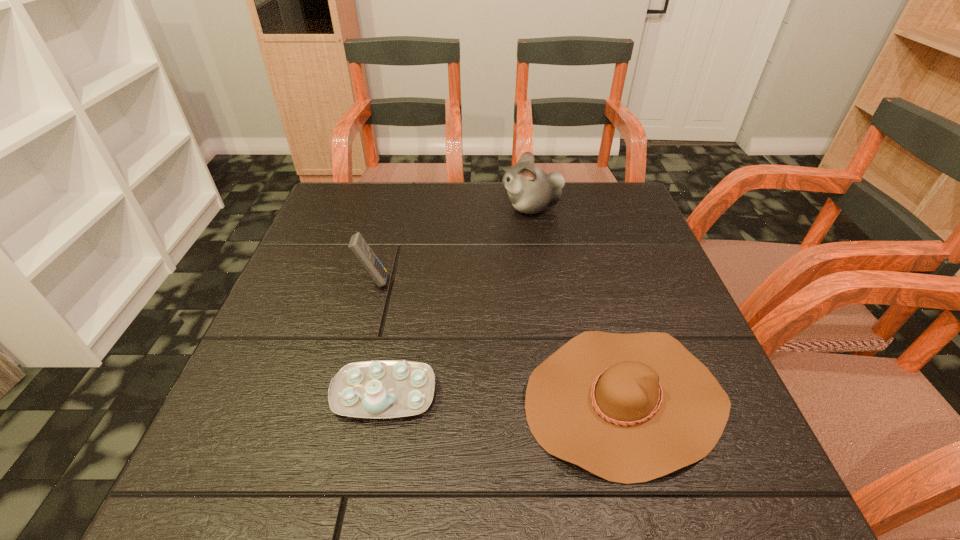
Find the location of `vacant space situated on the back of the chinaware`. vacant space situated on the back of the chinaware is located at coordinates (396, 329).

I want to click on vacant space situated 0.120m on the left of the shortest object, so click(454, 399).

The height and width of the screenshot is (540, 960). Identify the location of object that is at the far edge. (531, 190).

The width and height of the screenshot is (960, 540). Identify the location of object present at the near edge. (629, 408).

You are a GUI agent. You are given a task and a screenshot of the screen. Output one action in this format:
    pyautogui.click(x=<x>, y=<y>)
    Task: Click on the object that is at the left edge
    This screenshot has width=960, height=540.
    Given the screenshot: What is the action you would take?
    pyautogui.click(x=359, y=247)

What are the coordinates of `object located at the right edge` in the screenshot? It's located at (629, 408).

This screenshot has height=540, width=960. I want to click on object that is at the near right corner, so click(629, 408).

I want to click on vacant space at the far edge of the desktop, so click(x=555, y=207).

This screenshot has width=960, height=540. In the image, there is a desktop. Find the location of `vacant space at the near edge`. vacant space at the near edge is located at coordinates (563, 465).

At what (x,y) coordinates should I click in order to perform the action: click on vacant area at the left edge of the desktop. Please return your answer as a coordinate pair (x, y). Looking at the image, I should click on tap(320, 352).